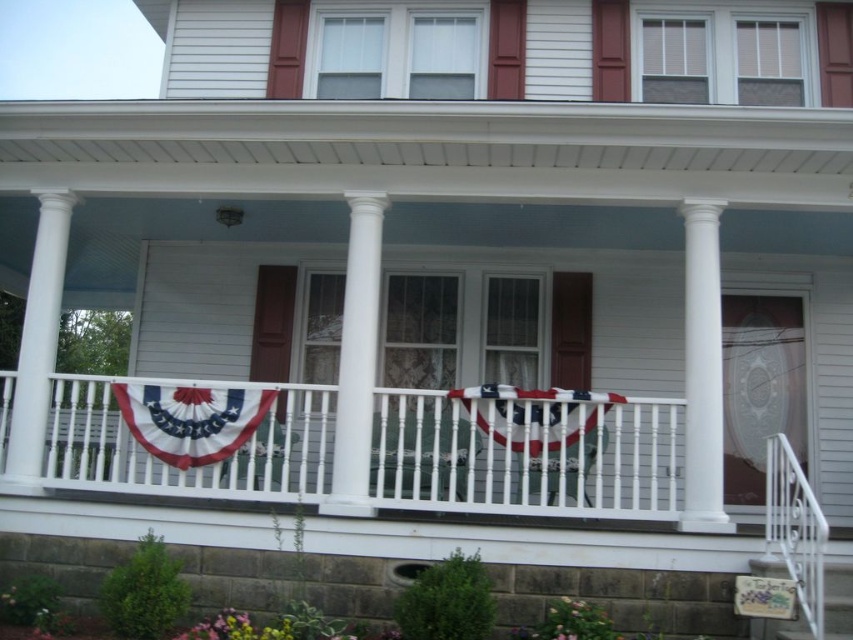
Is point (776, 524) farther from camera compared to point (584, 403)?

No, it is not.

Is white wrought iron railing at lower right positioned in front of american fabric flag at center?

Yes.

This screenshot has width=853, height=640. Identify the location of white wrought iron railing at lower right. (795, 529).

Does white smooth column at right appear on the left side of white smooth column at center?

No, white smooth column at right is not to the left of white smooth column at center.

From the picture: Between white smooth column at right and white smooth column at center, which one is positioned higher?

white smooth column at center

Is point (701, 221) in front of point (370, 422)?

No, (701, 221) is behind (370, 422).

Image resolution: width=853 pixels, height=640 pixels. What are the coordinates of `white smooth column at right` in the screenshot? It's located at (701, 372).

How far apart are bright red fabric banner at center and white wrought iron railing at lower right?

bright red fabric banner at center and white wrought iron railing at lower right are 3.98 meters apart from each other.

Does bright red fabric banner at center have a lesser width compared to white wrought iron railing at lower right?

In fact, bright red fabric banner at center might be wider than white wrought iron railing at lower right.

I want to click on bright red fabric banner at center, so click(190, 419).